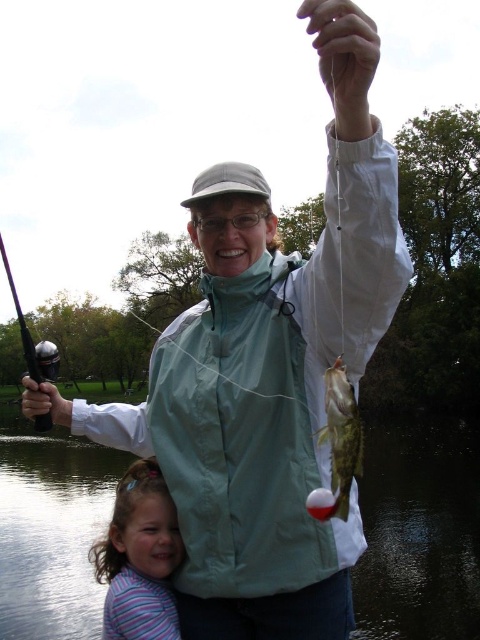
Question: Which point is closer to the camera taking this photo?

Choices:
 (A) (140, 628)
 (B) (313, 504)

Answer: (B)

Question: Is greenish-yellow textured fish at center bigger than shiny purple rod at left?

Choices:
 (A) no
 (B) yes

Answer: (A)

Question: Does striped cotton shirt at lower left appear on the left side of shiny purple rod at left?

Choices:
 (A) no
 (B) yes

Answer: (A)

Question: Which point appears farthest from the camera in this image?

Choices:
 (A) (344, 384)
 (B) (117, 497)
 (C) (61, 636)
 (D) (39, 428)

Answer: (C)

Question: Which point appears closest to the camera in this image?

Choices:
 (A) (372, 618)
 (B) (337, 400)
 (C) (163, 532)

Answer: (B)

Question: Does greenish-yellow textured fish at center have a greater width compared to shiny purple rod at left?

Choices:
 (A) no
 (B) yes

Answer: (A)